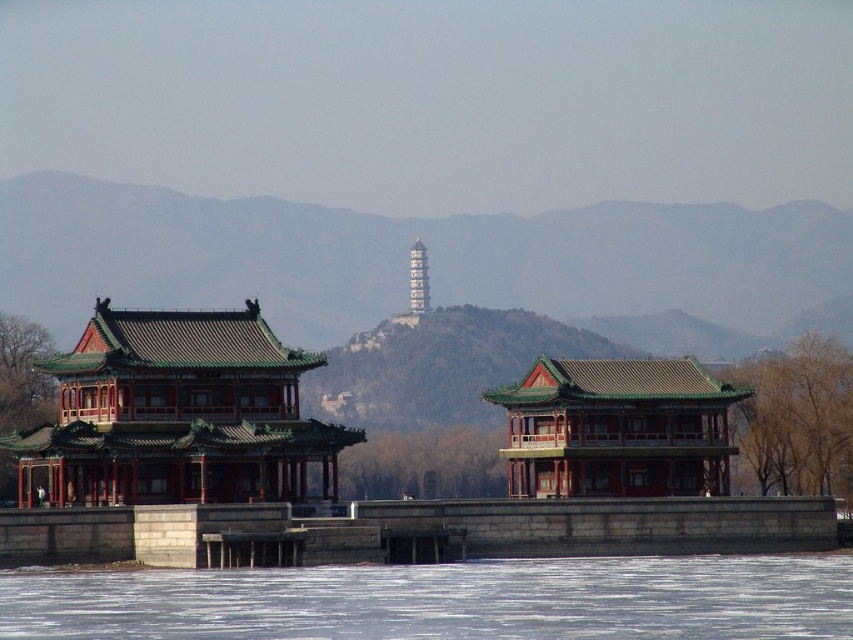
Question: Which object is positioned closest to the matte red wood temple at left?

Choices:
 (A) green glazed tile temple at center
 (B) gold metallic tower at center
 (C) green stone mountain at center
 (D) frozen ice at lower center

Answer: (D)

Question: Is frozen ice at lower center wider than green glazed tile temple at center?

Choices:
 (A) no
 (B) yes

Answer: (B)

Question: Which of the following is the farthest from the observer?

Choices:
 (A) (628, 308)
 (B) (219, 326)
 (C) (701, 604)
 (D) (608, 456)

Answer: (A)

Question: Can you confirm if frozen ice at lower center is thinner than green glazed tile temple at center?

Choices:
 (A) no
 (B) yes

Answer: (A)

Question: Which point is closer to the camera?

Choices:
 (A) (328, 310)
 (B) (50, 499)

Answer: (B)

Question: Is green stone mountain at center bigger than matte red wood temple at left?

Choices:
 (A) no
 (B) yes

Answer: (B)